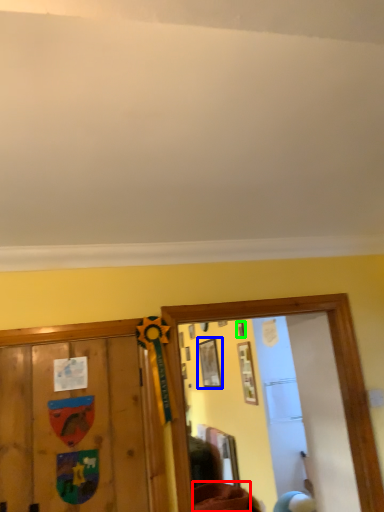
Question: Estimate the real-world distances between objects in this image. Which object is farther from furniture (highlighted by a red box), picture frame (highlighted by a blue box) or picture frame (highlighted by a green box)?

Choices:
 (A) picture frame
 (B) picture frame

Answer: (B)